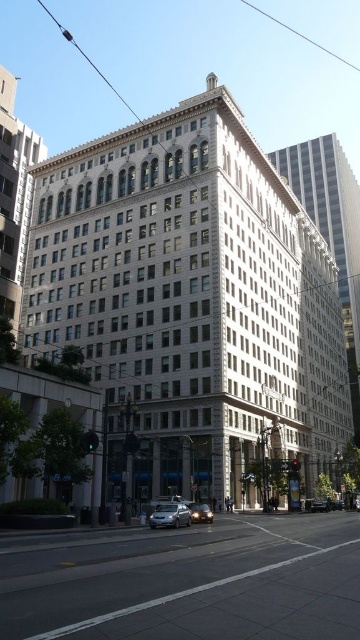
Consider the image. You are a delivery driver approaching the corner building. Your GPS shows a satin silver sedan at lower center parked at coordinates 0.806, 0.472. If you want to park your vehicle in the same spot, which direction should you drive relative to the building?

To park at the satin silver sedan at lower center located at coordinates (169,515), you should drive towards the building since the sedan is parked along the curb in front of it.

You are a delivery driver trying to park your satin silver sedan at lower center in a specific parking spot. The parking spot is marked at coordinates point A at 0.806, 0.472. Can you confirm if your vehicle is correctly positioned over the parking spot?

The satin silver sedan at lower center is located at point A at (169,515), so it is correctly positioned over the parking spot.